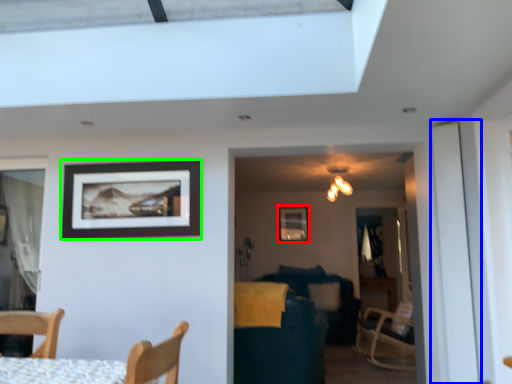
Question: Based on their relative distances, which object is nearer to picture frame (highlighted by a red box)? Choose from screen door (highlighted by a blue box) and picture frame (highlighted by a green box).

Choices:
 (A) screen door
 (B) picture frame

Answer: (B)